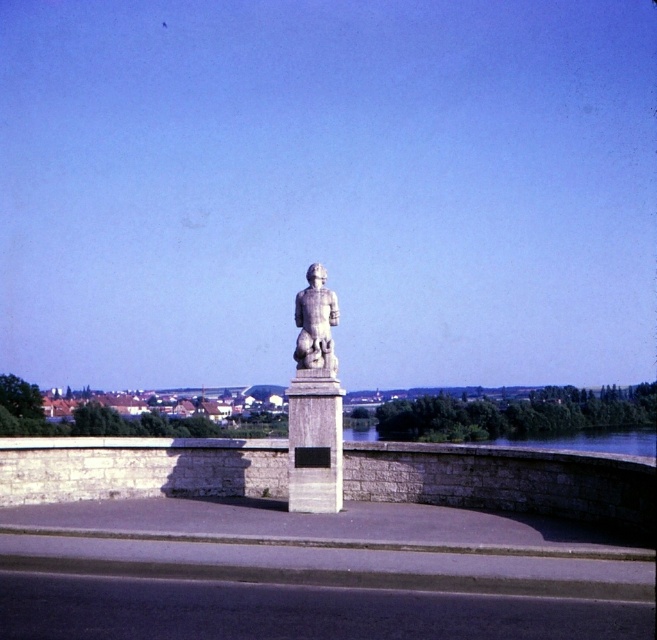
Question: Which of the following is the closest to the observer?

Choices:
 (A) stone statue at center
 (B) white stone statue at center

Answer: (B)

Question: Can you confirm if white stone statue at center is positioned above stone statue at center?

Choices:
 (A) no
 (B) yes

Answer: (A)

Question: Can you confirm if white stone statue at center is smaller than stone statue at center?

Choices:
 (A) yes
 (B) no

Answer: (B)

Question: From the image, what is the correct spatial relationship of white stone statue at center in relation to stone statue at center?

Choices:
 (A) below
 (B) above

Answer: (A)